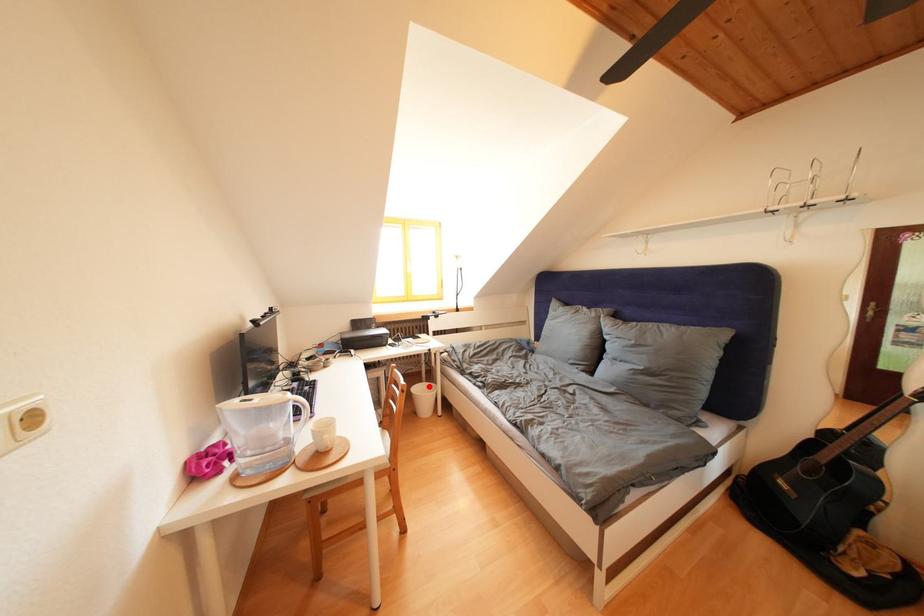
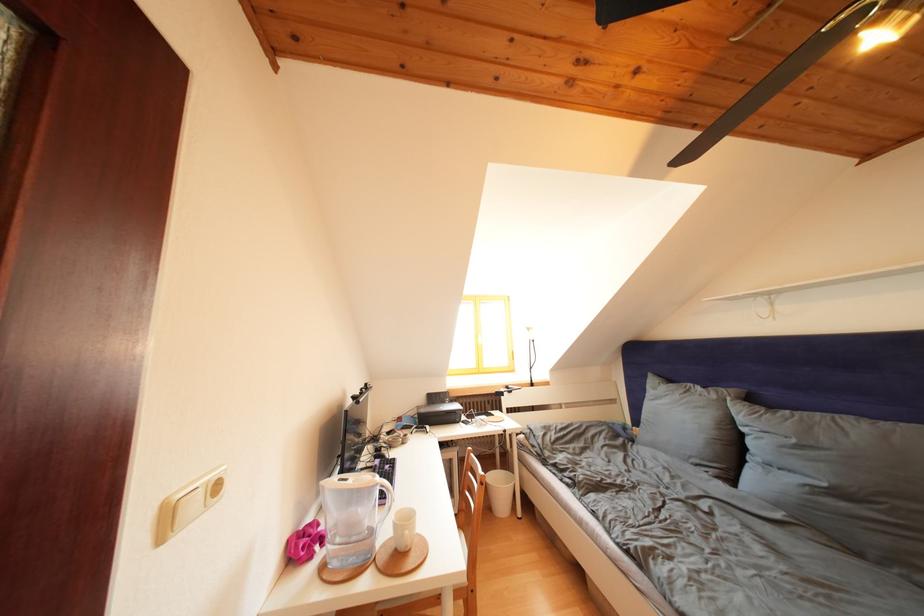
Where in the second image is the point corresponding to the highlighted location from the first image?

(503, 472)